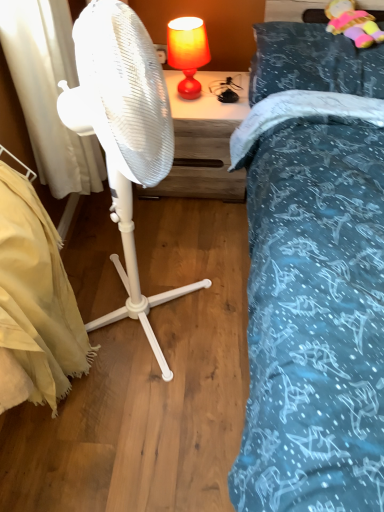
Locate an element on the screen. The image size is (384, 512). vacant space underneath white fabric curtain at left (from a real-world perspective) is located at coordinates (94, 227).